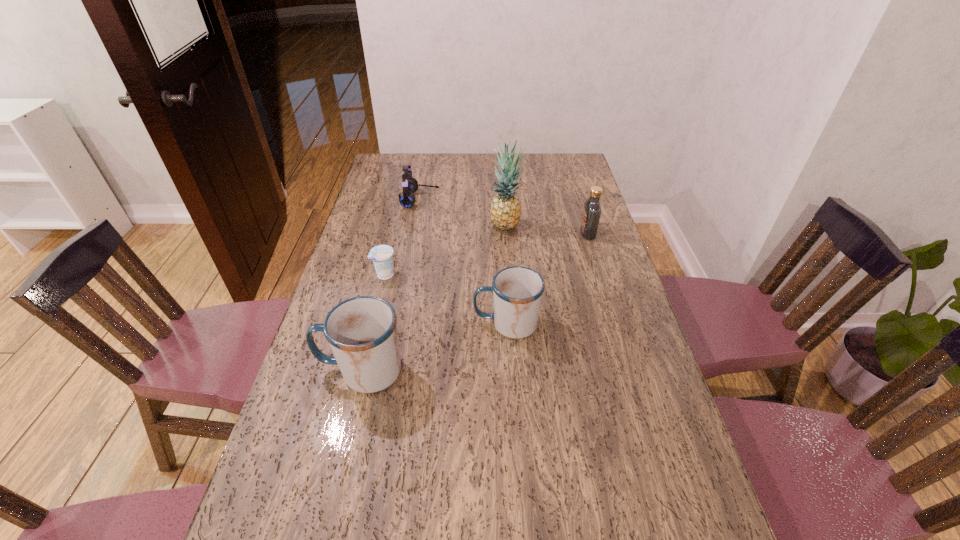
Where is `the nearest object`? The image size is (960, 540). the nearest object is located at coordinates (362, 333).

Find the location of a particular element. the taller mug is located at coordinates (362, 333).

At what (x,y) coordinates should I click in order to perform the action: click on the farther mug. Please return your answer as a coordinate pair (x, y). The width and height of the screenshot is (960, 540). Looking at the image, I should click on (517, 291).

At what (x,y) coordinates should I click in order to perform the action: click on the second nearest object. Please return your answer as a coordinate pair (x, y). Looking at the image, I should click on (517, 291).

Identify the location of headset. This screenshot has height=540, width=960. (410, 185).

You are a GUI agent. You are given a task and a screenshot of the screen. Output one action in this format:
    pyautogui.click(x=<x>, y=<y>)
    Task: Click on the tallest object
    
    Given the screenshot: What is the action you would take?
    pyautogui.click(x=505, y=212)

Identify the location of the rightmost object. (592, 210).

Locate an element on the screen. the third nearest object is located at coordinates (382, 255).

You are a GUI agent. You are given a task and a screenshot of the screen. Output one action in this format:
    pyautogui.click(x=<x>, y=<y>)
    Task: Click on the yogurt
    
    Given the screenshot: What is the action you would take?
    382,255

Where is `vacant area situated on the handle side of the farther mug`? The image size is (960, 540). vacant area situated on the handle side of the farther mug is located at coordinates (410, 324).